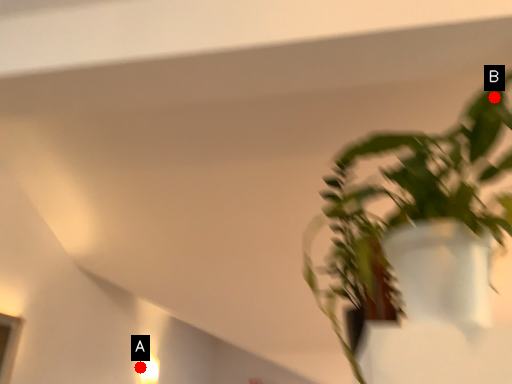
Question: Two points are circled on the image, labeled by A and B beside each circle. Which of the following is the farthest from the observer?

Choices:
 (A) A is further
 (B) B is further

Answer: (A)